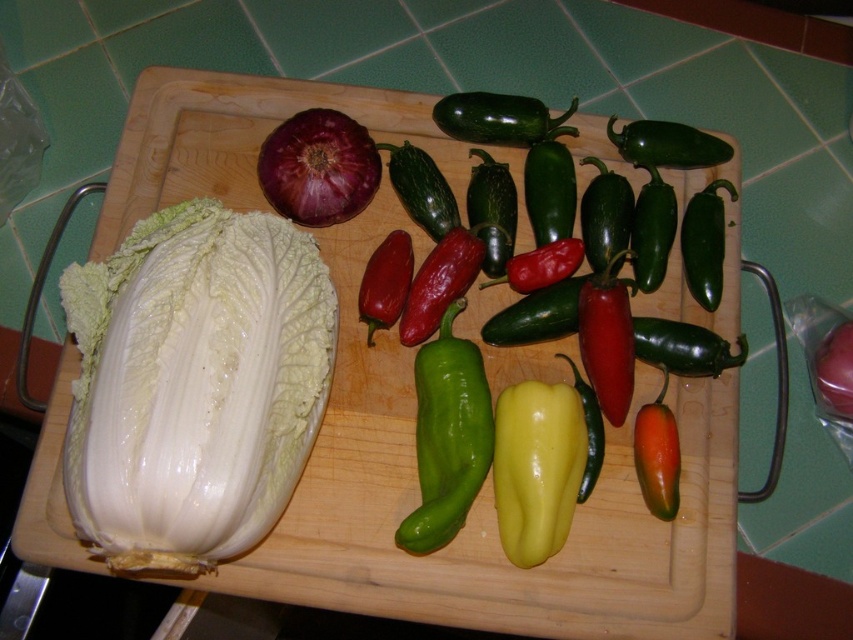
You are a chef preparing a vegetable platter and need to arrange the vegetables in a straight line from left to right. The white smooth cabbage at left and the matte purple onion at center are currently positioned on the cutting board. Can you fit another vegetable between them without moving the existing ones?

The distance between the white smooth cabbage at left and the matte purple onion at center is 10.38 inches. Since the question does not specify the size of the new vegetable, it is possible to fit another vegetable between them if it is smaller than 10.38 inches in width. However, without knowing the exact size of the new vegetable, it is impossible to determine definitively.

You are a chef preparing vegetables on the wooden cutting board. You need to place a new ingredient between the white smooth cabbage at left and the red onion. Where should you position it relative to the cabbage?

The white smooth cabbage at left is located at point (x=194, y=384), so you should place the new ingredient to the right of the white smooth cabbage at left since the red onion is adjacent to it.

You are preparing a vegetable platter and need to know which vegetable has a greater width. You have the white smooth cabbage at left and the green glossy bell pepper at center. Which one is wider?

The white smooth cabbage at left has a larger width than the green glossy bell pepper at center according to the description.